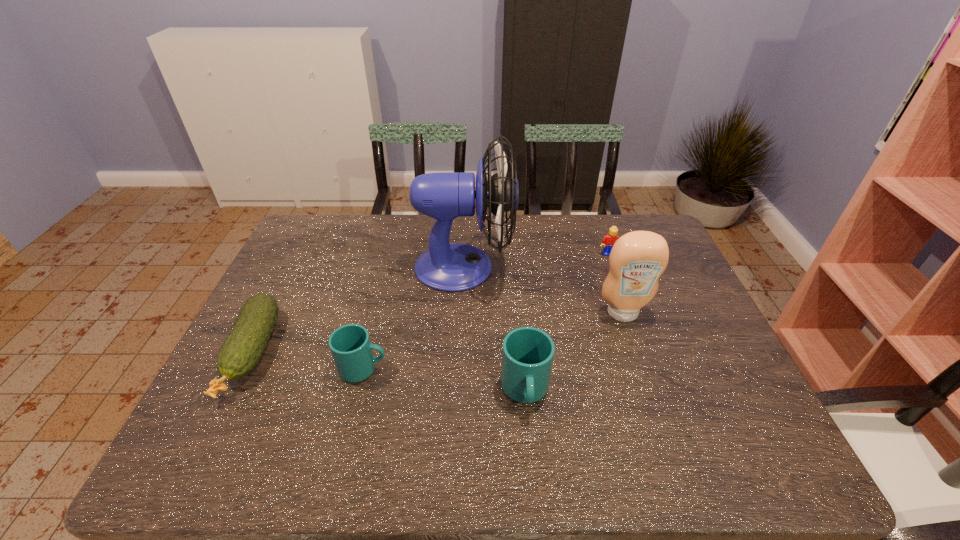
The height and width of the screenshot is (540, 960). Identify the location of object that is at the near left corner. (241, 351).

Locate an element on the screen. This screenshot has width=960, height=540. blank space at the far edge of the desktop is located at coordinates (454, 239).

This screenshot has height=540, width=960. In the image, there is a desktop. Find the location of `vacant area at the near edge`. vacant area at the near edge is located at coordinates (308, 401).

In the image, there is a desktop. In order to click on vacant space at the left edge in this screenshot , I will do `click(261, 379)`.

The image size is (960, 540). In order to click on free region at the right edge of the desktop in this screenshot , I will do `click(721, 360)`.

This screenshot has width=960, height=540. I want to click on vacant space at the far left corner of the desktop, so click(x=315, y=229).

Find the location of a particular element. This screenshot has height=540, width=960. blank space at the far right corner of the desktop is located at coordinates (656, 230).

Locate an element on the screen. The height and width of the screenshot is (540, 960). free space between the condiment and the taller cup is located at coordinates (574, 352).

This screenshot has height=540, width=960. I want to click on vacant space that is in between the fifth shortest object and the tallest object, so click(543, 290).

Where is `vacant point located between the tallest object and the Lego`? This screenshot has width=960, height=540. vacant point located between the tallest object and the Lego is located at coordinates (537, 260).